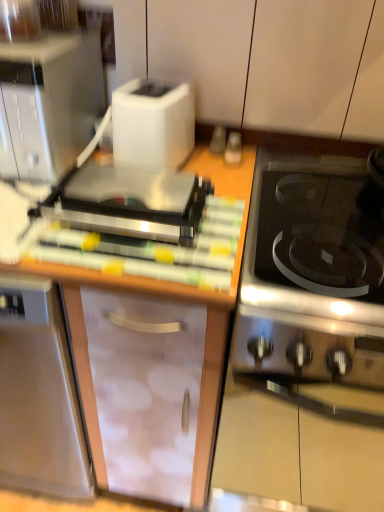
Identify the location of vacant area on top of satin silver toaster at upper left (from a real-world perspective). The image size is (384, 512). (126, 187).